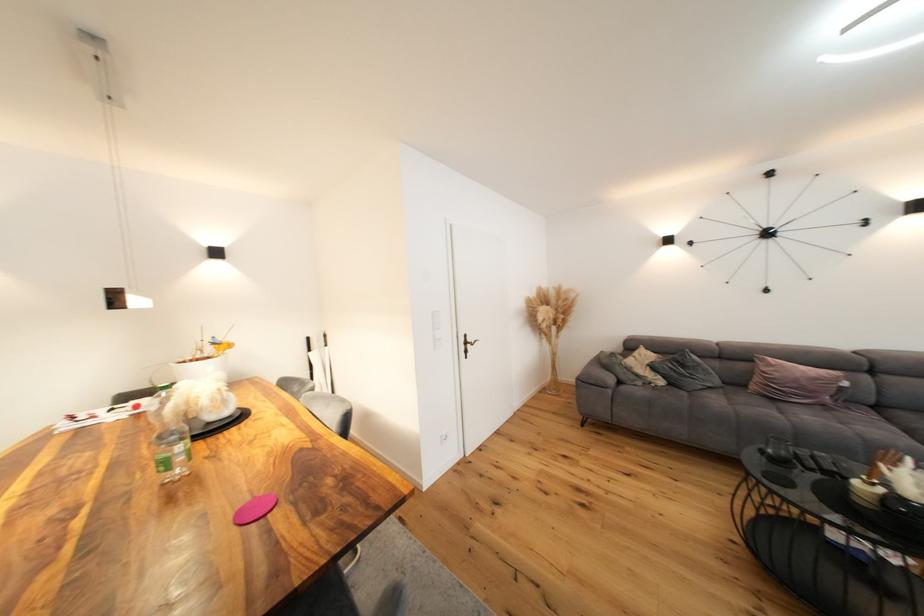
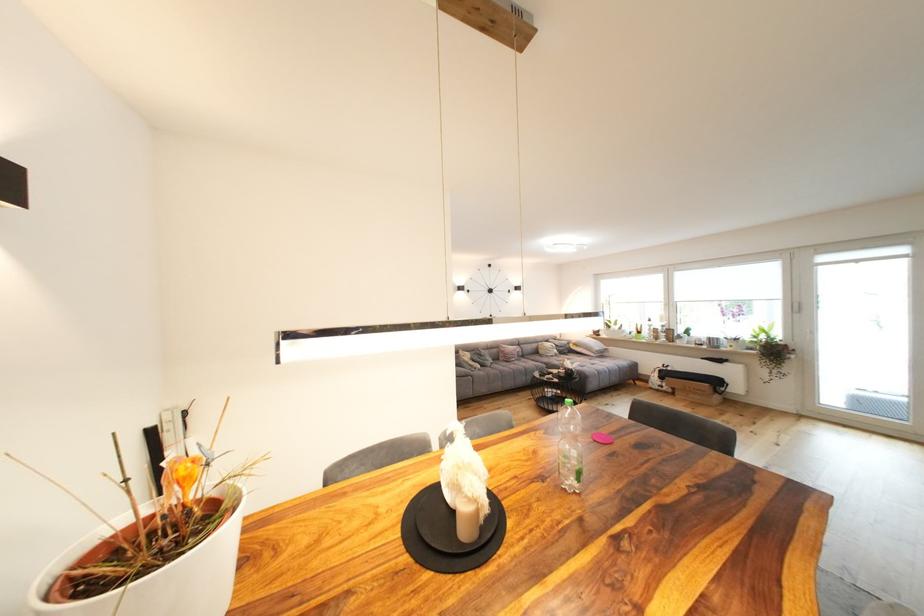
Find the pixel in the second image that matches (x=667, y=384) in the first image.

(485, 368)